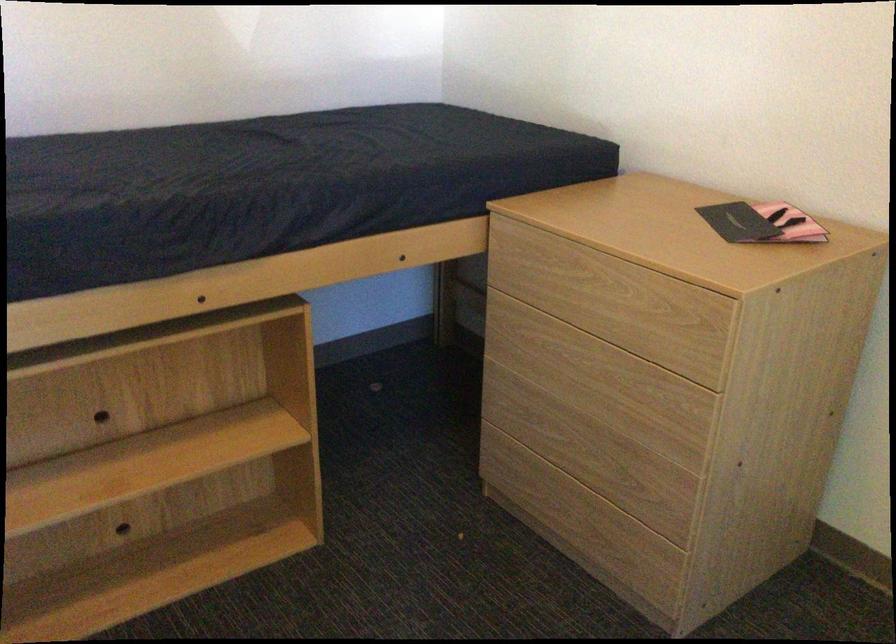
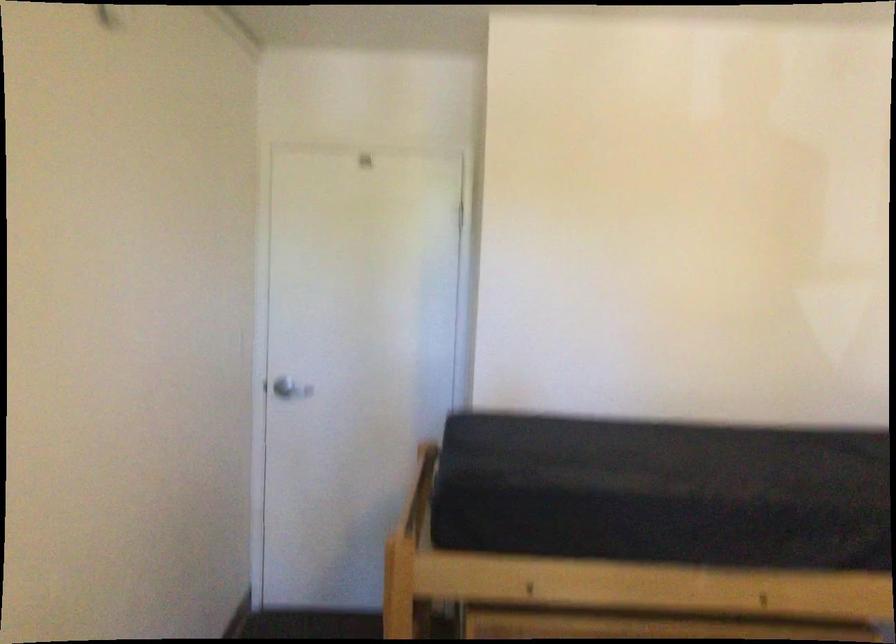
The images are taken continuously from a first-person perspective. In which direction is your viewpoint rotating?

The rotation direction of the camera is left-up.